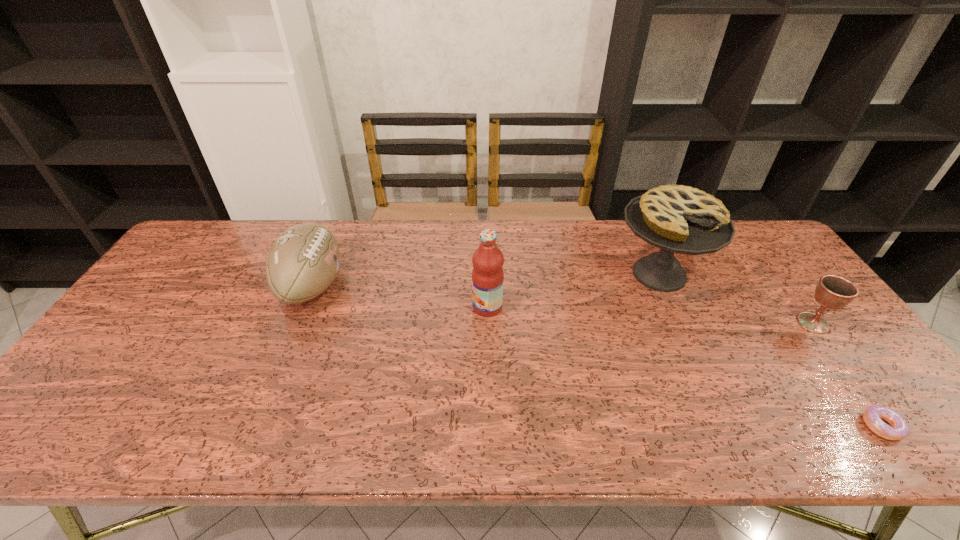
Identify the location of free space located on the front label of the fruit juice. Image resolution: width=960 pixels, height=540 pixels. (455, 307).

The image size is (960, 540). Find the location of `vacant space situated 0.290m on the laces of the leftmost object`. vacant space situated 0.290m on the laces of the leftmost object is located at coordinates (441, 286).

Where is `free region located on the left of the chalice`? This screenshot has width=960, height=540. free region located on the left of the chalice is located at coordinates (764, 323).

Where is `blank space located on the left of the shortest object`? This screenshot has width=960, height=540. blank space located on the left of the shortest object is located at coordinates (837, 426).

I want to click on pie that is at the far edge, so click(680, 219).

The width and height of the screenshot is (960, 540). What are the coordinates of `football (American) located at the far edge` in the screenshot? It's located at (303, 261).

Where is `object located at the near edge`? The image size is (960, 540). object located at the near edge is located at coordinates (872, 416).

This screenshot has height=540, width=960. I want to click on chalice situated at the right edge, so click(x=834, y=292).

At what (x,y) coordinates should I click in order to perform the action: click on doughnut present at the right edge. Please return your answer as a coordinate pair (x, y). This screenshot has width=960, height=540. Looking at the image, I should click on (872, 416).

Locate an element on the screen. object that is at the near right corner is located at coordinates (872, 416).